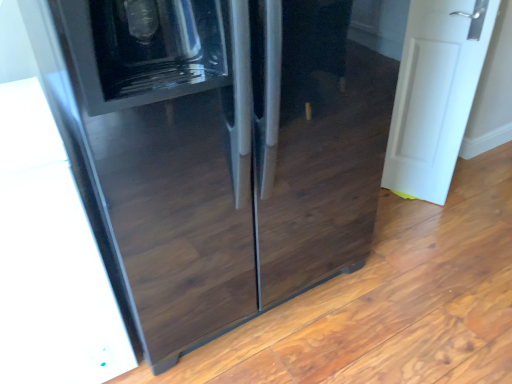
Question: Is glossy black refrigerator at center closer to camera compared to white matte door at right?

Choices:
 (A) yes
 (B) no

Answer: (A)

Question: From a real-world perspective, is glossy black refrigerator at center beneath white matte door at right?

Choices:
 (A) yes
 (B) no

Answer: (B)

Question: Is glossy black refrigerator at center in contact with white matte door at right?

Choices:
 (A) no
 (B) yes

Answer: (A)

Question: From a real-world perspective, does glossy black refrigerator at center stand above white matte door at right?

Choices:
 (A) yes
 (B) no

Answer: (A)

Question: Can you confirm if glossy black refrigerator at center is smaller than white matte door at right?

Choices:
 (A) yes
 (B) no

Answer: (B)

Question: Is glossy black refrigerator at center looking in the opposite direction of white matte door at right?

Choices:
 (A) no
 (B) yes

Answer: (A)

Question: Is glossy black refrigerator at center completely or partially inside white matte door at right?

Choices:
 (A) no
 (B) yes

Answer: (A)

Question: Is white matte door at right thinner than glossy black refrigerator at center?

Choices:
 (A) no
 (B) yes

Answer: (B)

Question: Is white matte door at right turned away from glossy black refrigerator at center?

Choices:
 (A) no
 (B) yes

Answer: (B)

Question: From the image's perspective, is white matte door at right beneath glossy black refrigerator at center?

Choices:
 (A) yes
 (B) no

Answer: (B)

Question: Would you say white matte door at right is outside glossy black refrigerator at center?

Choices:
 (A) no
 (B) yes

Answer: (B)

Question: Is white matte door at right shorter than glossy black refrigerator at center?

Choices:
 (A) no
 (B) yes

Answer: (B)

Question: From the image's perspective, is glossy black refrigerator at center above or below white matte door at right?

Choices:
 (A) below
 (B) above

Answer: (A)